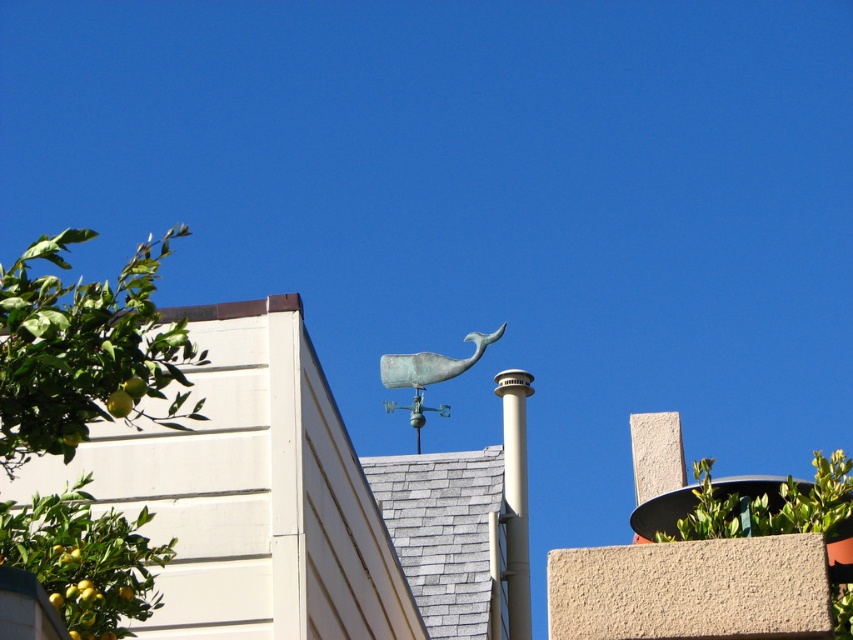
Question: Is green leafy tree at left smaller than green patina whale at center?

Choices:
 (A) yes
 (B) no

Answer: (B)

Question: Does green leafy tree at left appear on the left side of green patina whale at center?

Choices:
 (A) yes
 (B) no

Answer: (A)

Question: Among these points, which one is farthest from the camera?

Choices:
 (A) (163, 563)
 (B) (833, 612)
 (C) (508, 376)
 (D) (384, 404)

Answer: (D)

Question: Which point is closer to the camera?

Choices:
 (A) green patina whale at center
 (B) silver metallic chimney at center
 (C) green leafy tree at upper center
 (D) green leafy tree at left

Answer: (D)

Question: From the image, what is the correct spatial relationship of green leafy tree at left in relation to silver metallic chimney at center?

Choices:
 (A) left
 (B) right

Answer: (A)

Question: Which point is farther to the camera?

Choices:
 (A) [93, 360]
 (B) [838, 592]
 (C) [502, 404]

Answer: (C)